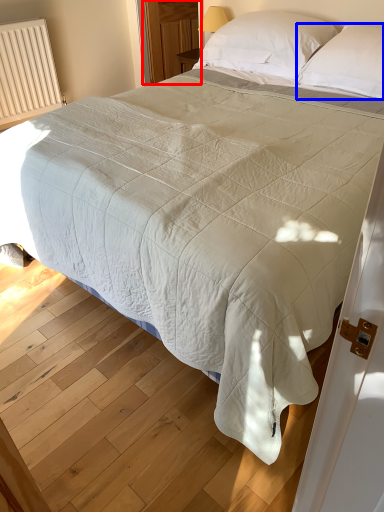
Question: Which point is closer to the camera, glass door (highlighted by a red box) or pillow (highlighted by a blue box)?

Choices:
 (A) glass door
 (B) pillow

Answer: (B)